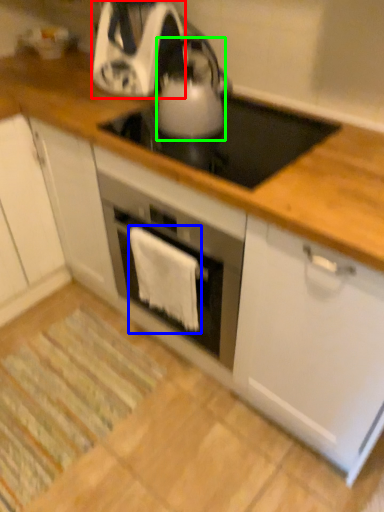
Question: Estimate the real-world distances between objects in this image. Which object is farther from kitchen appliance (highlighted by a red box), cloth (highlighted by a blue box) or kitchen appliance (highlighted by a green box)?

Choices:
 (A) cloth
 (B) kitchen appliance

Answer: (A)